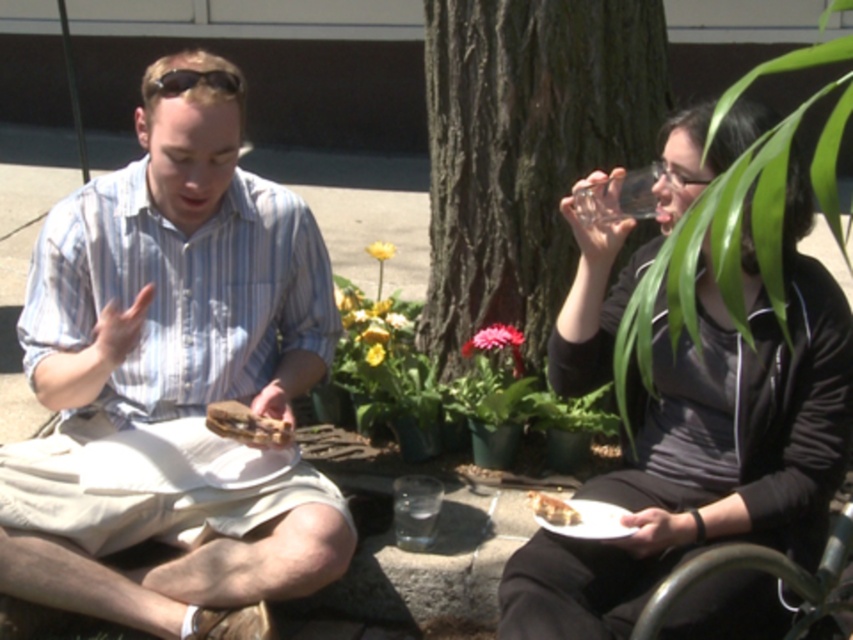
Is matte black jacket at center wider than crumbly brown bread at lower center?

Yes.

Consider the image. Can you confirm if matte black jacket at center is positioned above crumbly brown bread at lower center?

Indeed, matte black jacket at center is positioned over crumbly brown bread at lower center.

Is point (769, 348) closer to camera compared to point (534, 508)?

Yes, it is in front of point (534, 508).

Locate an element on the screen. matte black jacket at center is located at coordinates (708, 449).

Does transparent glass at upper right have a greater width compared to matte black sunglasses at upper center?

Indeed, transparent glass at upper right has a greater width compared to matte black sunglasses at upper center.

Can you confirm if transparent glass at upper right is positioned below matte black sunglasses at upper center?

Indeed, transparent glass at upper right is positioned under matte black sunglasses at upper center.

Identify the location of transparent glass at upper right. The image size is (853, 640). (618, 196).

Locate an element on the screen. The width and height of the screenshot is (853, 640). transparent glass at upper right is located at coordinates (618, 196).

Which is below, matte black jacket at center or matte black sunglasses at upper center?

matte black jacket at center is below.

Is point (704, 186) positioned before point (157, 80)?

Yes, point (704, 186) is in front of point (157, 80).

The image size is (853, 640). In order to click on matte black jacket at center in this screenshot , I will do `click(708, 449)`.